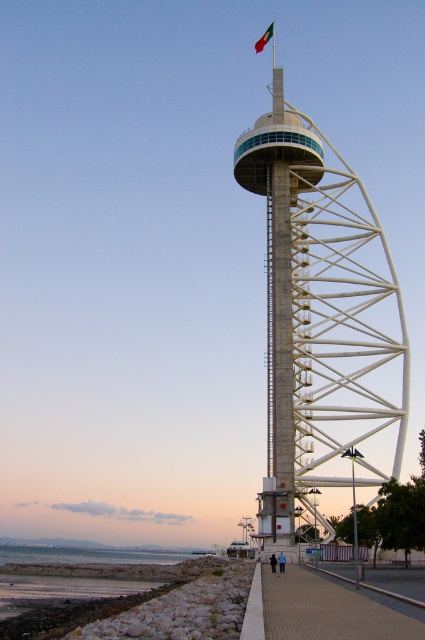
Can you confirm if white concrete tower at center is positioned to the left of paved brick sidewalk at lower center?

Incorrect, white concrete tower at center is not on the left side of paved brick sidewalk at lower center.

Which is above, white concrete tower at center or paved brick sidewalk at lower center?

white concrete tower at center

What do you see at coordinates (322, 316) in the screenshot?
I see `white concrete tower at center` at bounding box center [322, 316].

Find the location of a particular element. This screenshot has height=640, width=425. white concrete tower at center is located at coordinates (322, 316).

Which is above, paved brick sidewalk at lower center or green fabric flag at upper center?

green fabric flag at upper center

Which is below, paved brick sidewalk at lower center or green fabric flag at upper center?

paved brick sidewalk at lower center

Identify the location of paved brick sidewalk at lower center. The height and width of the screenshot is (640, 425). (326, 609).

Is point (345, 300) behind point (261, 36)?

No, it is not.

Is the position of white concrete tower at center more distant than that of green fabric flag at upper center?

No, it is in front of green fabric flag at upper center.

What do you see at coordinates (322, 316) in the screenshot? I see `white concrete tower at center` at bounding box center [322, 316].

Find the location of a particular element. The width and height of the screenshot is (425, 640). white concrete tower at center is located at coordinates (322, 316).